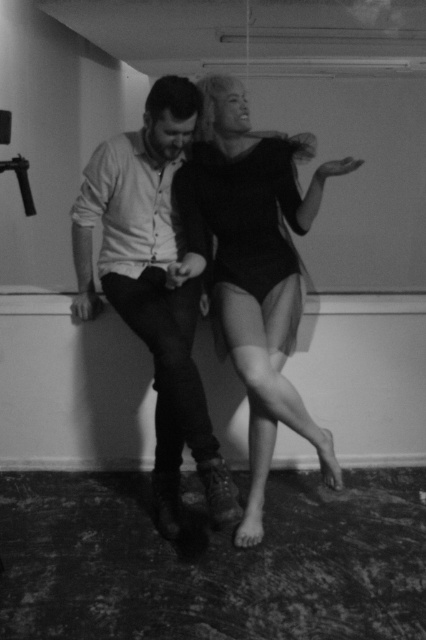
You are designing a clothing catalog and need to decide which item to feature first based on their sizes. According to the image, which clothing item is smaller in size between the smooth black bodysuit at center and the matte white shirt at center?

The smooth black bodysuit at center has a smaller size compared to the matte white shirt at center, so it should be featured first if prioritizing smaller sizes.

You are standing at the origin of the coordinate system in this indoor scene. You see two points marked in the image. Which point is closer to you, point (291,276) or point (261,179)?

Point (261,179) is closer to you because it is in front of point (291,276).

You are a photographer standing in front of the scene. You want to take a closeup shot of the matte white shirt at center. Can you move closer to it without stepping into the frame of the original image?

The matte white shirt at center is 1.97 meters away from camera, so yes, you can move closer to it as long as you stay within the 1.97 meters distance to capture the closeup without entering the frame.